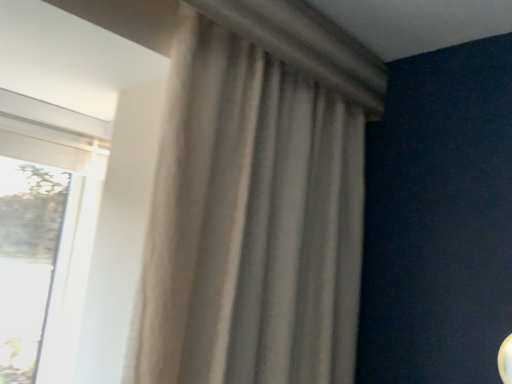
Question: Could you tell me if transparent glass window at left is turned towards beige fabric curtain at center?

Choices:
 (A) no
 (B) yes

Answer: (B)

Question: Considering the relative positions of transparent glass window at left and beige fabric curtain at center in the image provided, is transparent glass window at left to the right of beige fabric curtain at center from the viewer's perspective?

Choices:
 (A) yes
 (B) no

Answer: (B)

Question: Is transparent glass window at left further to the viewer compared to beige fabric curtain at center?

Choices:
 (A) no
 (B) yes

Answer: (B)

Question: Is transparent glass window at left wider than beige fabric curtain at center?

Choices:
 (A) yes
 (B) no

Answer: (B)

Question: Would you say transparent glass window at left is a long distance from beige fabric curtain at center?

Choices:
 (A) no
 (B) yes

Answer: (A)

Question: From a real-world perspective, is transparent glass window at left under beige fabric curtain at center?

Choices:
 (A) no
 (B) yes

Answer: (B)

Question: From the image's perspective, is beige fabric curtain at center on transparent glass window at left?

Choices:
 (A) no
 (B) yes

Answer: (B)

Question: Is transparent glass window at left at the back of beige fabric curtain at center?

Choices:
 (A) no
 (B) yes

Answer: (B)

Question: Considering the relative positions of beige fabric curtain at center and transparent glass window at left in the image provided, is beige fabric curtain at center to the left of transparent glass window at left from the viewer's perspective?

Choices:
 (A) no
 (B) yes

Answer: (A)

Question: Can you confirm if beige fabric curtain at center is smaller than transparent glass window at left?

Choices:
 (A) no
 (B) yes

Answer: (A)

Question: Is beige fabric curtain at center next to transparent glass window at left and touching it?

Choices:
 (A) yes
 (B) no

Answer: (B)

Question: Is beige fabric curtain at center shorter than transparent glass window at left?

Choices:
 (A) yes
 (B) no

Answer: (B)

Question: Is beige fabric curtain at center wider or thinner than transparent glass window at left?

Choices:
 (A) wide
 (B) thin

Answer: (A)